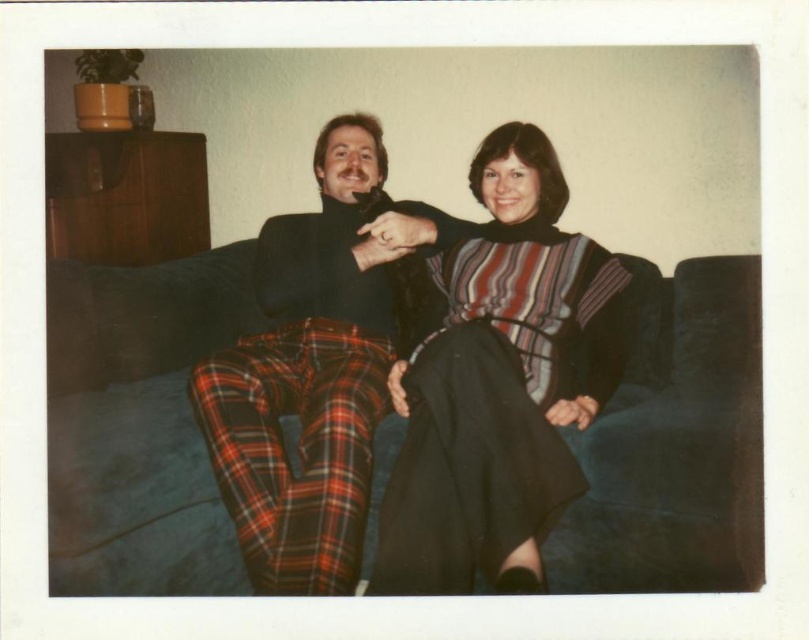
You are a tailor who needs to place a new striped knit sweater at center onto the velvet blue couch at center. The minimum distance required between the sweater and the couch to ensure proper placement is 30 inches. Can the sweater be placed as desired?

The distance between the velvet blue couch at center and striped knit sweater at center is 25.00 inches, which is less than the required 30 inches. Therefore, the sweater cannot be placed as desired without adjusting the distance.

You are a photographer setting up for a portrait in this living room. You need to position a light source to the right of the striped knit sweater at center. Will the velvet blue couch at center block the light from reaching the sweater?

The velvet blue couch at center is to the left of the striped knit sweater at center, so placing the light to the right of the sweater would not be blocked by the couch since they are positioned left and right relative to each other.

You are a photographer setting up a shoot in this living room. You need to place a small tripod between the velvet blue couch at center and the plaid wool pants at center. According to the scene description, where should you position the tripod?

The plaid wool pants at center is behind the velvet blue couch at center, so you should place the tripod in front of the velvet blue couch at center to ensure it is between both objects.